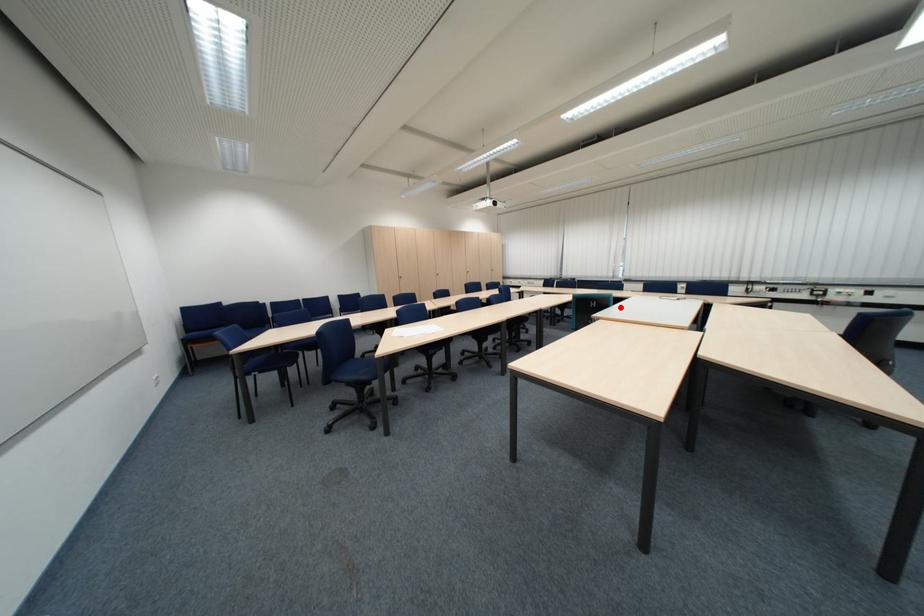
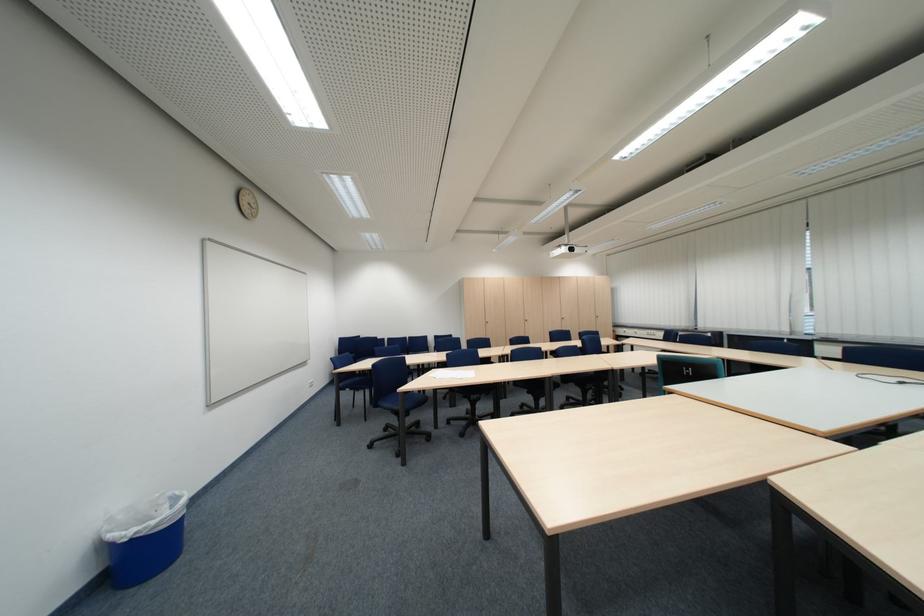
Question: I am providing you with two images of the same scene from different viewpoints. A red point is marked on the first image. At the location where the point appears in image 1, is it still visible in image 2?

Choices:
 (A) Yes
 (B) No

Answer: (A)